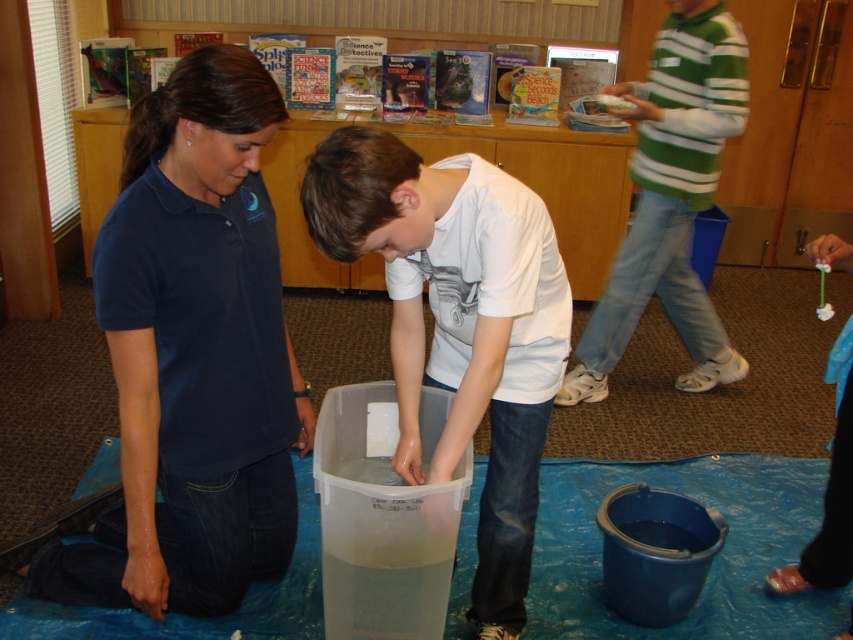
Question: Can you confirm if dark blue cotton shirt at center is wider than green striped sweater at upper right?

Choices:
 (A) no
 (B) yes

Answer: (B)

Question: Which point is closer to the camera?

Choices:
 (A) dark blue cotton shirt at center
 (B) green striped sweater at upper right

Answer: (A)

Question: Which object is farther from the camera taking this photo?

Choices:
 (A) green striped sweater at upper right
 (B) white matte shirt at center

Answer: (A)

Question: Can you confirm if dark blue cotton shirt at center is thinner than green striped sweater at upper right?

Choices:
 (A) yes
 (B) no

Answer: (B)

Question: Which point appears closest to the camera in this image?

Choices:
 (A) (526, 536)
 (B) (48, 573)
 (C) (648, 214)

Answer: (A)

Question: Is dark blue cotton shirt at center smaller than green striped sweater at upper right?

Choices:
 (A) no
 (B) yes

Answer: (B)